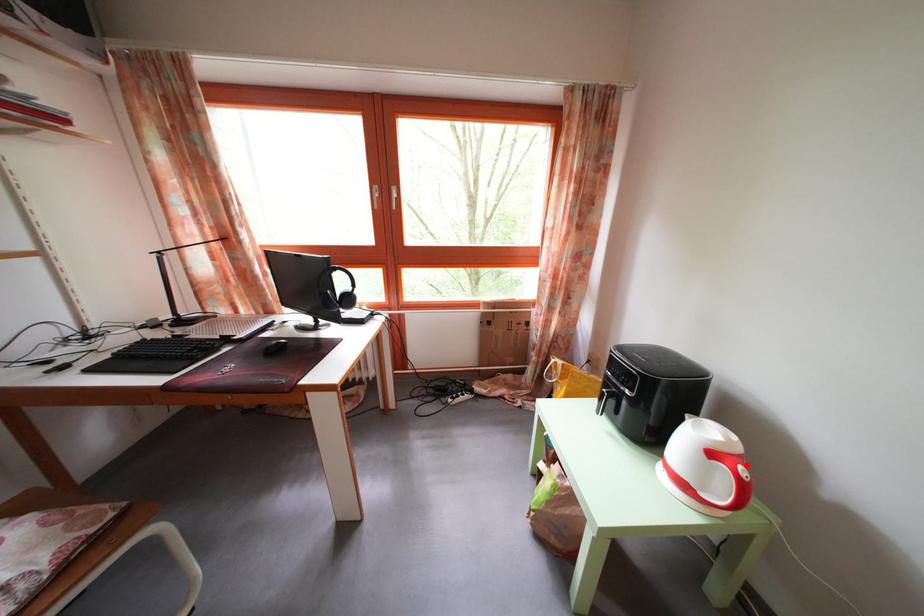
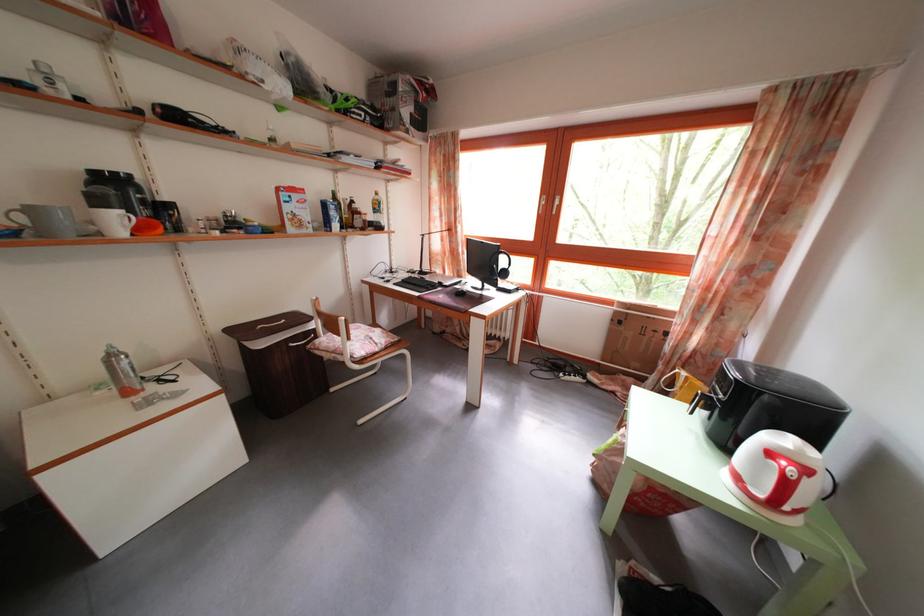
Question: A red point is marked in image1. In image2, is the corresponding 3D point closer to the camera or farther? Reply with the corresponding letter.

Choices:
 (A) The corresponding 3D point is closer.
 (B) The corresponding 3D point is farther.

Answer: (A)